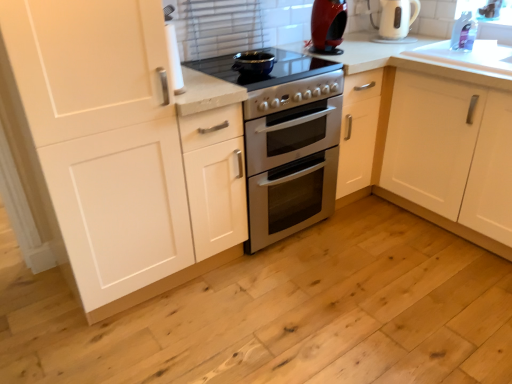
Find the location of a particular element. This screenshot has height=384, width=512. vacant region to the left of white glossy electric kettle at upper right is located at coordinates (360, 41).